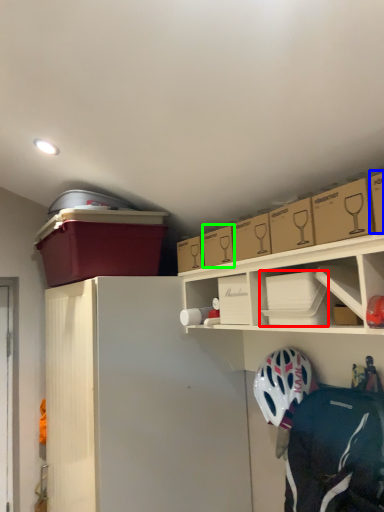
Question: Estimate the real-world distances between objects in this image. Which object is closer to box (highlighted by a red box), box (highlighted by a blue box) or box (highlighted by a green box)?

Choices:
 (A) box
 (B) box

Answer: (B)